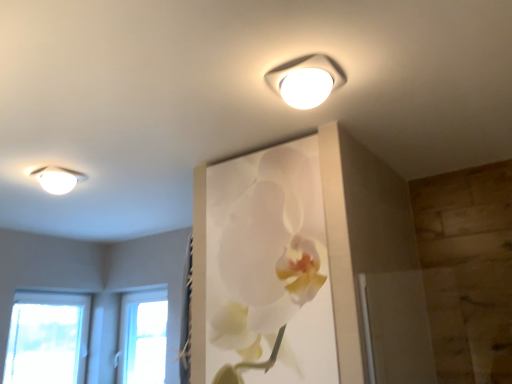
Question: Is transparent glass window at lower left at the back of white matte orchid at upper center?

Choices:
 (A) no
 (B) yes

Answer: (A)

Question: From a real-world perspective, is white matte orchid at upper center under transparent glass window at lower left?

Choices:
 (A) no
 (B) yes

Answer: (A)

Question: Does white matte orchid at upper center touch transparent glass window at lower left?

Choices:
 (A) yes
 (B) no

Answer: (B)

Question: Is white matte orchid at upper center at the left side of transparent glass window at lower left?

Choices:
 (A) yes
 (B) no

Answer: (B)

Question: Is white matte orchid at upper center located outside transparent glass window at lower left?

Choices:
 (A) yes
 (B) no

Answer: (A)

Question: Is white matte orchid at upper center to the right of transparent glass window at lower left from the viewer's perspective?

Choices:
 (A) no
 (B) yes

Answer: (B)

Question: Can you confirm if white glossy ceiling light at upper left, the first lamp in the left-to-right sequence, is shorter than white matte orchid at upper center?

Choices:
 (A) yes
 (B) no

Answer: (A)

Question: Does white glossy ceiling light at upper left, the second lamp in the right-to-left sequence, have a larger size compared to white matte orchid at upper center?

Choices:
 (A) no
 (B) yes

Answer: (A)

Question: Does white glossy ceiling light at upper left, which is counted as the 1th lamp, starting from the bottom, appear on the left side of white matte orchid at upper center?

Choices:
 (A) no
 (B) yes

Answer: (B)

Question: Does white glossy ceiling light at upper left, the first lamp in the left-to-right sequence, touch white matte orchid at upper center?

Choices:
 (A) no
 (B) yes

Answer: (A)

Question: Does white glossy ceiling light at upper left, the 1th lamp when ordered from back to front, lie behind white matte orchid at upper center?

Choices:
 (A) no
 (B) yes

Answer: (B)

Question: From a real-world perspective, is white glossy ceiling light at upper left, the 1th lamp when ordered from back to front, on top of white matte orchid at upper center?

Choices:
 (A) yes
 (B) no

Answer: (A)

Question: From a real-world perspective, is white glossy ceiling light at upper left, the first lamp in the left-to-right sequence, beneath white plastic lamp at upper center, positioned as the 1th lamp in top-to-bottom order?

Choices:
 (A) yes
 (B) no

Answer: (A)